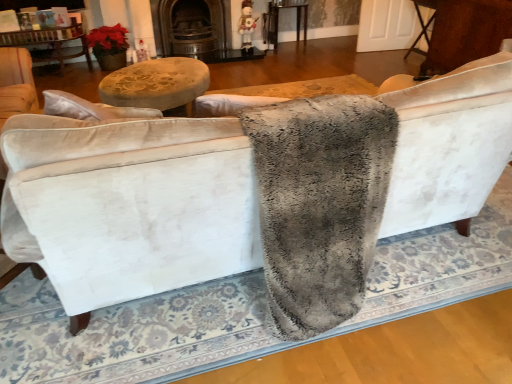
Question: From a real-world perspective, is wooden table at center, which is the 2th table from right to left, located beneath dark brown wood fireplace at upper center?

Choices:
 (A) yes
 (B) no

Answer: (A)

Question: From the image's perspective, is wooden table at center, placed as the 1th table when sorted from back to front, located above dark brown wood fireplace at upper center?

Choices:
 (A) yes
 (B) no

Answer: (A)

Question: From a real-world perspective, is wooden table at center, placed as the 2th table when sorted from front to back, on dark brown wood fireplace at upper center?

Choices:
 (A) yes
 (B) no

Answer: (B)

Question: Is wooden table at center, placed as the 2th table when sorted from front to back, aimed at dark brown wood fireplace at upper center?

Choices:
 (A) no
 (B) yes

Answer: (A)

Question: Is wooden table at center, which is the 2th table from right to left, to the left of dark brown wood fireplace at upper center from the viewer's perspective?

Choices:
 (A) no
 (B) yes

Answer: (A)

Question: Is wooden table at center, which is the 2th table from right to left, smaller than dark brown wood fireplace at upper center?

Choices:
 (A) no
 (B) yes

Answer: (B)

Question: Is dark brown wood fireplace at upper center wider than gray fluffy blanket at center?

Choices:
 (A) yes
 (B) no

Answer: (B)

Question: Does dark brown wood fireplace at upper center come behind gray fluffy blanket at center?

Choices:
 (A) yes
 (B) no

Answer: (A)

Question: Is dark brown wood fireplace at upper center at the right side of gray fluffy blanket at center?

Choices:
 (A) yes
 (B) no

Answer: (B)

Question: Considering the relative positions of dark brown wood fireplace at upper center and gray fluffy blanket at center in the image provided, is dark brown wood fireplace at upper center in front of gray fluffy blanket at center?

Choices:
 (A) yes
 (B) no

Answer: (B)

Question: Can you confirm if dark brown wood fireplace at upper center is smaller than gray fluffy blanket at center?

Choices:
 (A) no
 (B) yes

Answer: (B)

Question: Is dark brown wood fireplace at upper center in contact with gray fluffy blanket at center?

Choices:
 (A) yes
 (B) no

Answer: (B)

Question: From a real-world perspective, is dark brown wood fireplace at upper center located beneath wooden table at center, which is the 2th table from right to left?

Choices:
 (A) no
 (B) yes

Answer: (A)